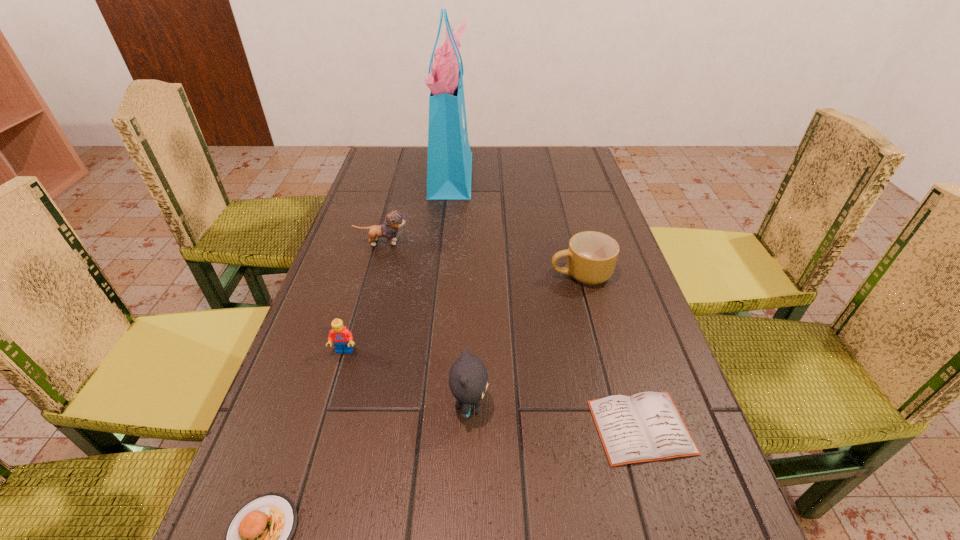
Find the location of a particular element. The width and height of the screenshot is (960, 540). mug located at the right edge is located at coordinates pyautogui.click(x=592, y=256).

Identify the location of diary that is at the right edge. The height and width of the screenshot is (540, 960). (647, 426).

This screenshot has width=960, height=540. In order to click on vacant region at the far edge of the desktop in this screenshot , I will do `click(421, 158)`.

The height and width of the screenshot is (540, 960). In the image, there is a desktop. Identify the location of vacant space at the left edge. (373, 267).

In the image, there is a desktop. At what (x,y) coordinates should I click in order to perform the action: click on free space at the right edge. Please return your answer as a coordinate pair (x, y). This screenshot has height=540, width=960. Looking at the image, I should click on (620, 352).

Find the location of a particular element. The height and width of the screenshot is (540, 960). vacant area between the right kitten and the tallest object is located at coordinates (461, 289).

Locate an element on the screen. vacant point located between the left kitten and the right kitten is located at coordinates (426, 325).

The height and width of the screenshot is (540, 960). What are the coordinates of `vacant point located between the right kitten and the mug` in the screenshot? It's located at (525, 340).

This screenshot has height=540, width=960. I want to click on vacant area that lies between the farthest object and the second tallest object, so click(461, 289).

The height and width of the screenshot is (540, 960). In order to click on free space between the shortest object and the farthest object in this screenshot , I will do `click(546, 300)`.